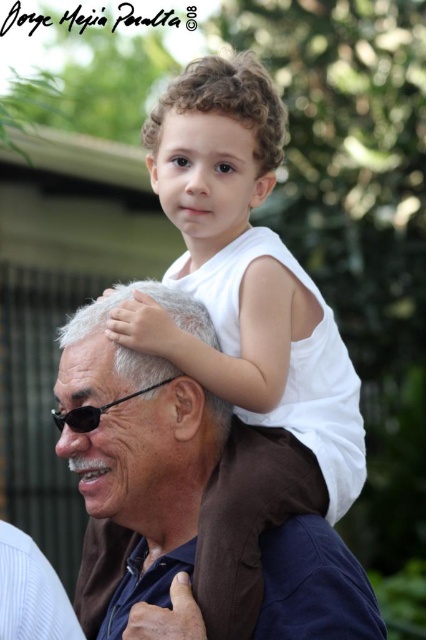
Question: Is brown fabric at center closer to camera compared to black plastic goggles at center?

Choices:
 (A) no
 (B) yes

Answer: (B)

Question: Is brown fabric at center bigger than black plastic goggles at center?

Choices:
 (A) no
 (B) yes

Answer: (B)

Question: Which point is closer to the camera?

Choices:
 (A) (150, 528)
 (B) (143, 390)

Answer: (B)

Question: Which point is closer to the camera?

Choices:
 (A) (161, 384)
 (B) (152, 369)

Answer: (B)

Question: Can you confirm if brown fabric at center is wider than black plastic goggles at center?

Choices:
 (A) yes
 (B) no

Answer: (A)

Question: Among these objects, which one is farthest from the camera?

Choices:
 (A) brown fabric at center
 (B) black plastic goggles at center

Answer: (B)